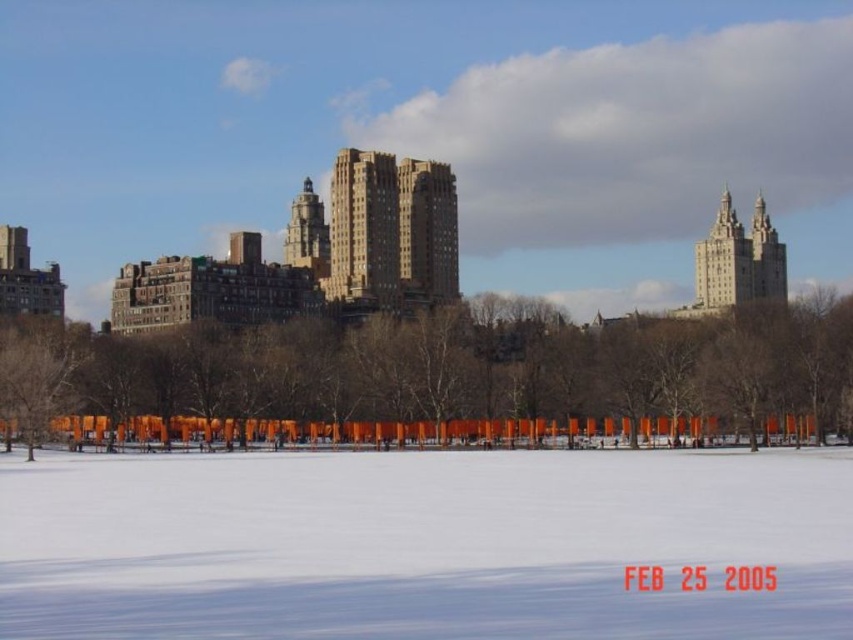
You are planning to place a small decorative statue that is 1 meter wide on the white powdery snow at center. Considering the width of the snow area, will it fit without overlapping the matte brown tower at center?

The white powdery snow at center has a larger width than the matte brown tower at center, so placing a 1 meter wide statue on the snow should be possible without overlapping the tower, provided the statue is placed within the snow area.